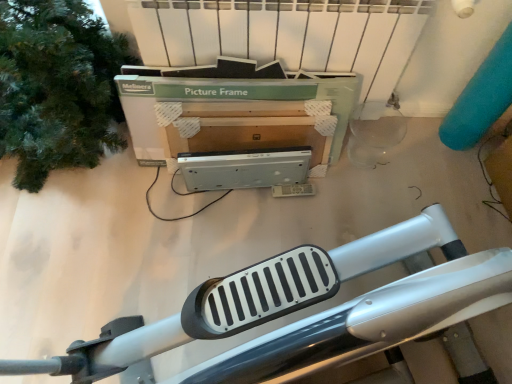
Question: Considering the positions of point (39, 97) and point (259, 94), is point (39, 97) closer or farther from the camera than point (259, 94)?

Choices:
 (A) closer
 (B) farther

Answer: (B)

Question: From the image's perspective, relative to green cardboard picture frame at upper center, is green matte tree at left above or below?

Choices:
 (A) below
 (B) above

Answer: (B)

Question: Which of these objects is positioned farthest from the silver metallic exercise machine at lower center?

Choices:
 (A) green cardboard picture frame at upper center
 (B) green matte tree at left

Answer: (B)

Question: Estimate the real-world distances between objects in this image. Which object is farther from the green matte tree at left?

Choices:
 (A) green cardboard picture frame at upper center
 (B) silver metallic exercise machine at lower center

Answer: (B)